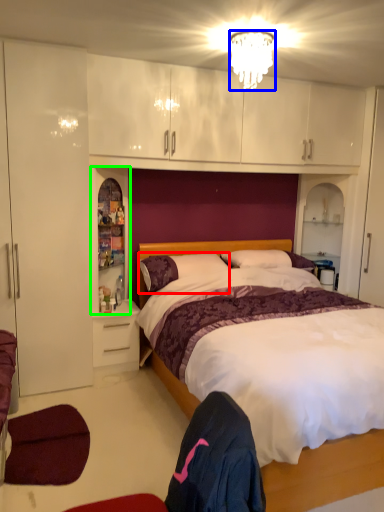
Question: Which is farther away from pillow (highlighted by a red box)? lamp (highlighted by a blue box) or cabinet (highlighted by a green box)?

Choices:
 (A) lamp
 (B) cabinet

Answer: (A)